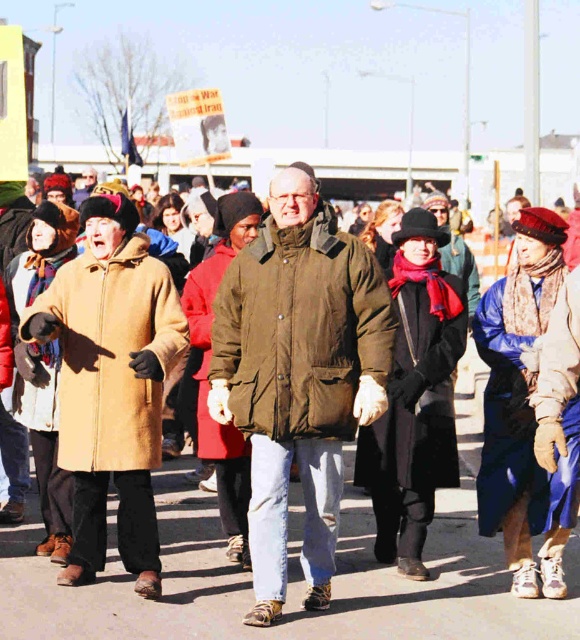
Question: Can you confirm if olive-green parka at center is positioned to the left of beige wool coat at left?

Choices:
 (A) no
 (B) yes

Answer: (A)

Question: Which point is farther to the camera?

Choices:
 (A) beige wool coat at left
 (B) olive-green parka at center
 (C) brown wool coat at center

Answer: (A)

Question: Which object is closer to the camera taking this photo?

Choices:
 (A) brown wool coat at center
 (B) beige wool coat at left

Answer: (A)

Question: Is brown wool coat at center in front of olive-green parka at center?

Choices:
 (A) yes
 (B) no

Answer: (A)

Question: Estimate the real-world distances between objects in this image. Which object is closer to the olive-green parka at center?

Choices:
 (A) brown wool coat at center
 (B) beige wool coat at left

Answer: (B)

Question: Can you confirm if brown wool coat at center is thinner than olive-green parka at center?

Choices:
 (A) yes
 (B) no

Answer: (B)